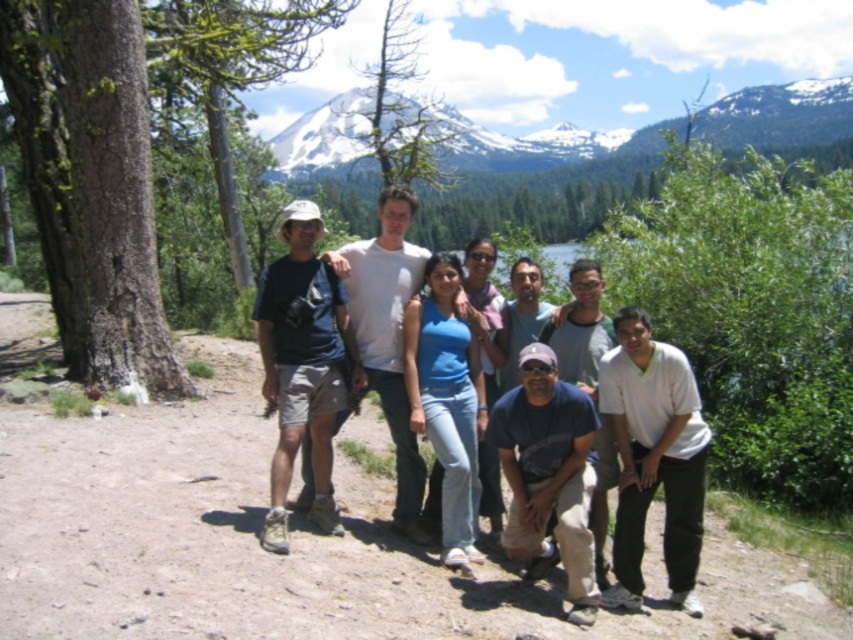
Which is behind, point (410, 349) or point (659, 445)?

The point (410, 349) is more distant.

Does matte blue shirt at center appear under white cotton shirt at lower right?

No.

Image resolution: width=853 pixels, height=640 pixels. Describe the element at coordinates (367, 372) in the screenshot. I see `matte blue shirt at center` at that location.

In order to click on matte blue shirt at center in this screenshot , I will do `click(367, 372)`.

Is white cotton shirt at lower right taller than matte black shirt at center?

Incorrect, white cotton shirt at lower right's height is not larger of matte black shirt at center's.

Is white cotton shirt at lower right closer to camera compared to matte black shirt at center?

No, white cotton shirt at lower right is behind matte black shirt at center.

Which is behind, point (639, 504) or point (326, 353)?

Positioned behind is point (326, 353).

Where is `white cotton shirt at lower right`? This screenshot has height=640, width=853. white cotton shirt at lower right is located at coordinates (653, 458).

From the picture: Is matte blue shirt at center shorter than matte black shirt at center?

No, matte blue shirt at center is not shorter than matte black shirt at center.

Is point (368, 346) positioned before point (328, 296)?

No.

Looking at this image, measure the distance between matte blue shirt at center and camera.

The distance of matte blue shirt at center from camera is 56.09 feet.

Locate an element on the screen. This screenshot has height=640, width=853. matte blue shirt at center is located at coordinates (367, 372).